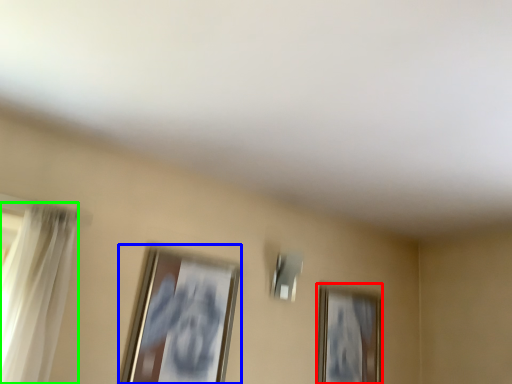
Question: Which object is the farthest from picture frame (highlighted by a red box)? Choose among these: picture frame (highlighted by a blue box) or curtain (highlighted by a green box).

Choices:
 (A) picture frame
 (B) curtain

Answer: (B)